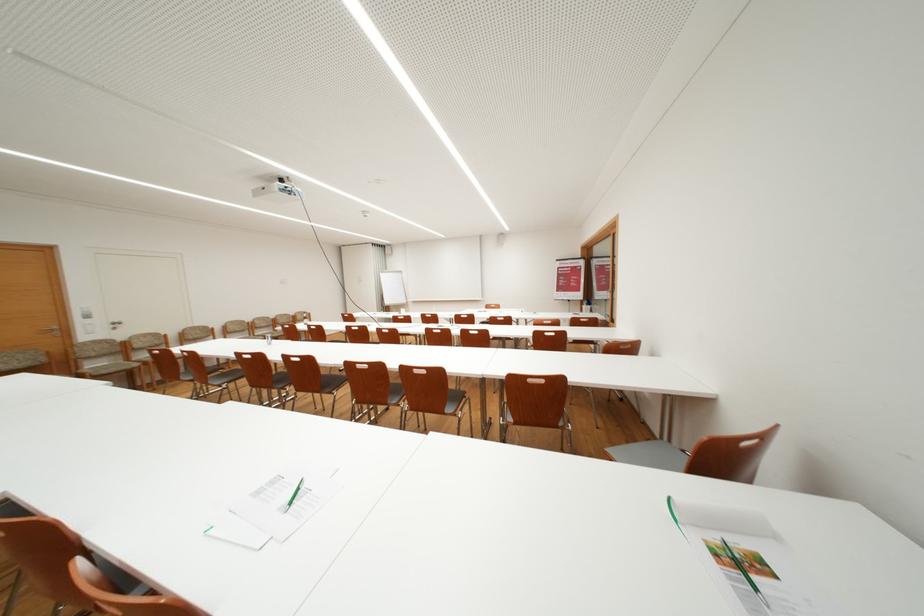
At what (x,y) coordinates should I click in order to perform the action: click on white light switch. Please return your answer as a coordinate pair (x, y). Looking at the image, I should click on (86, 326).